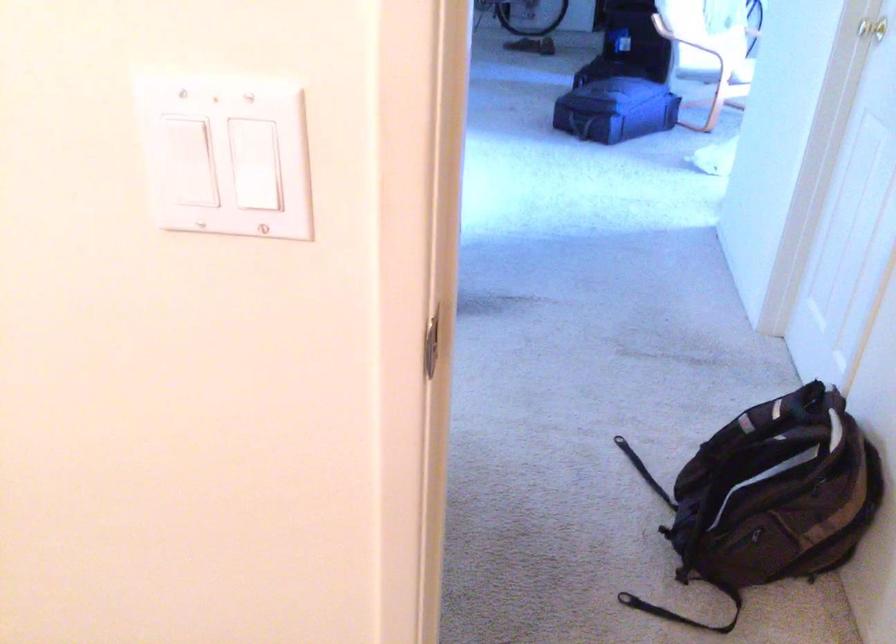
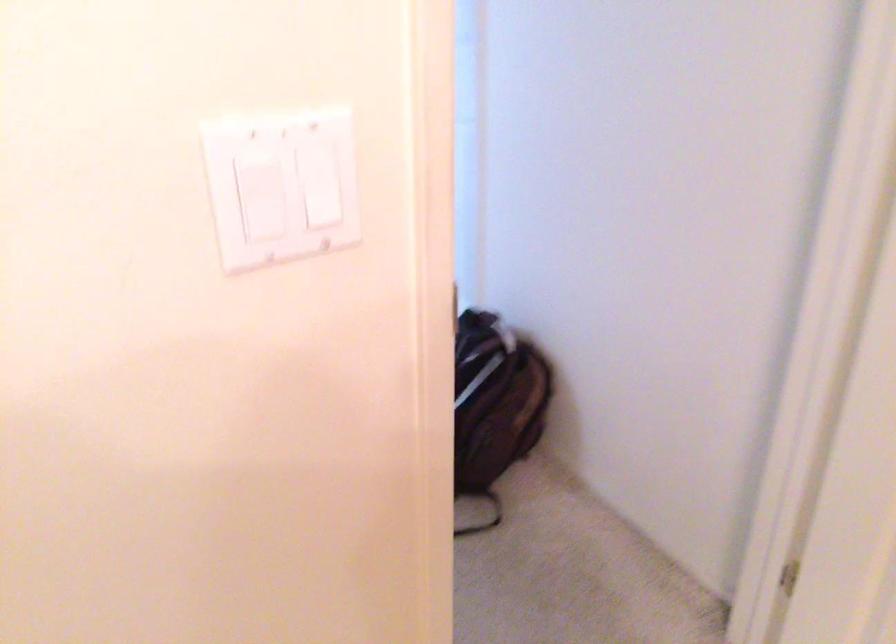
In the second image, find the point that corresponds to (x=780, y=498) in the first image.

(494, 404)